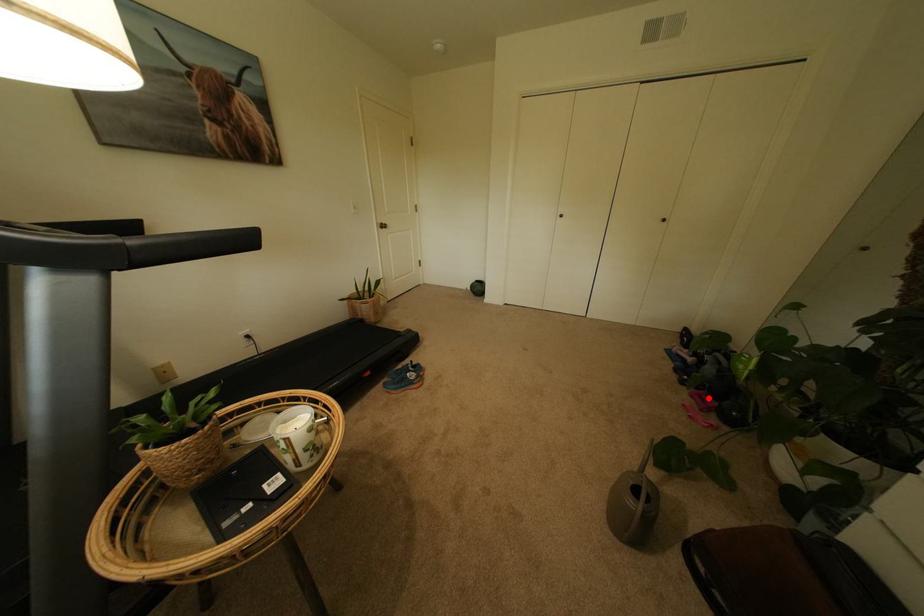
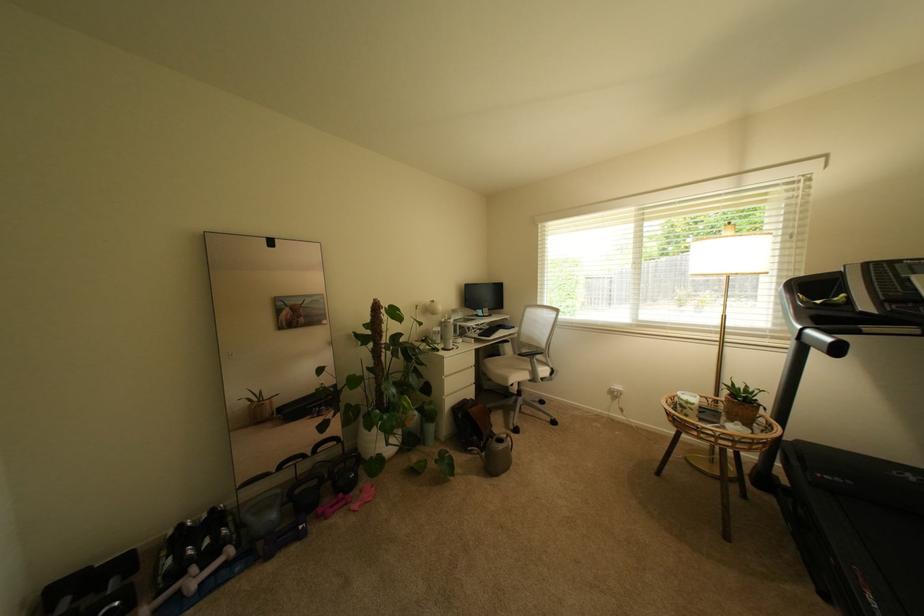
Question: I am providing you with two images of the same scene from different viewpoints. Given a red point in image1, look at the same physical point in image2. Is it:

Choices:
 (A) Closer to the viewpoint
 (B) Farther from the viewpoint

Answer: (A)